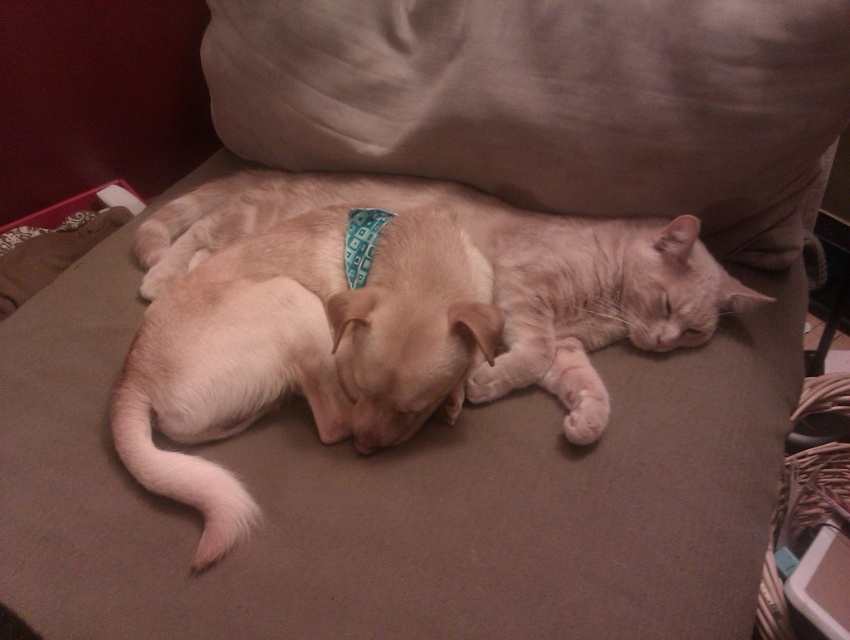
In the scene shown: You are trying to decide where to place a new throw blanket in the living room. You want to put it over both the beige fabric pillow at upper center and the fuzzy beige dog at center. Based on their sizes, which one would require a larger blanket?

The beige fabric pillow at upper center is bigger than the fuzzy beige dog at center, so it would require a larger blanket.

You are a photographer trying to capture a closeup of the light brown fur at center while ensuring the fuzzy beige dog at center is still visible in the frame. Based on their positions, can you tell me which direction you should aim the camera to include both subjects?

The fuzzy beige dog at center is positioned on the left side of light brown fur at center. To include both subjects in the frame, aim the camera towards the left side of the light brown fur at center where the fuzzy beige dog at center is located.